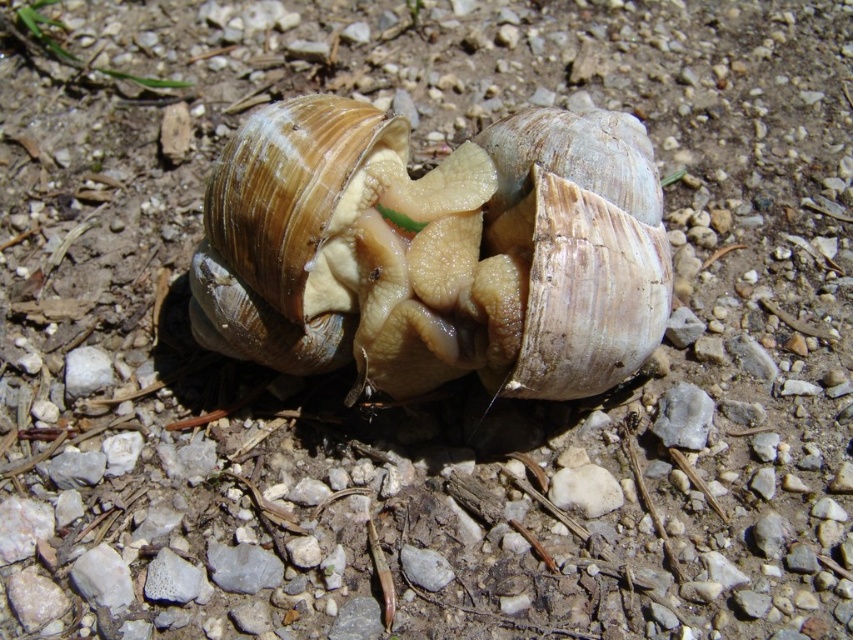
Who is more forward, (398, 120) or (640, 294)?

Point (640, 294) is in front.

Between brown textured shell at center and matte brown shell at center, which one appears on the left side from the viewer's perspective?

brown textured shell at center is more to the left.

Image resolution: width=853 pixels, height=640 pixels. Describe the element at coordinates (334, 248) in the screenshot. I see `brown textured shell at center` at that location.

This screenshot has width=853, height=640. In order to click on brown textured shell at center in this screenshot , I will do `click(334, 248)`.